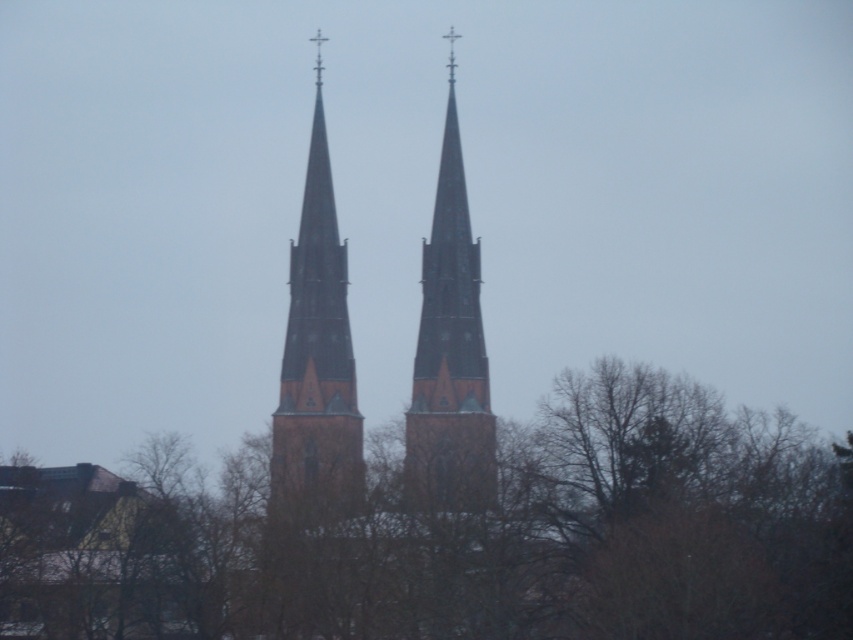
Is dark brown stone tower at center to the right of brown stone tower at center from the viewer's perspective?

No, dark brown stone tower at center is not to the right of brown stone tower at center.

Does point (338, 352) come closer to viewer compared to point (454, 193)?

Yes, it is.

This screenshot has width=853, height=640. In order to click on dark brown stone tower at center in this screenshot , I will do `click(316, 365)`.

Does brown leafless tree at center have a lesser width compared to dark brown stone tower at center?

No, brown leafless tree at center is not thinner than dark brown stone tower at center.

Which is behind, point (210, 636) or point (312, 481)?

The point (312, 481) is more distant.

Where is `brown leafless tree at center`? brown leafless tree at center is located at coordinates (476, 536).

Is brown leafless tree at center below brown stone tower at center?

Indeed, brown leafless tree at center is positioned under brown stone tower at center.

Is brown leafless tree at center taller than brown stone tower at center?

No, brown leafless tree at center is not taller than brown stone tower at center.

What are the coordinates of `brown leafless tree at center` in the screenshot? It's located at (476, 536).